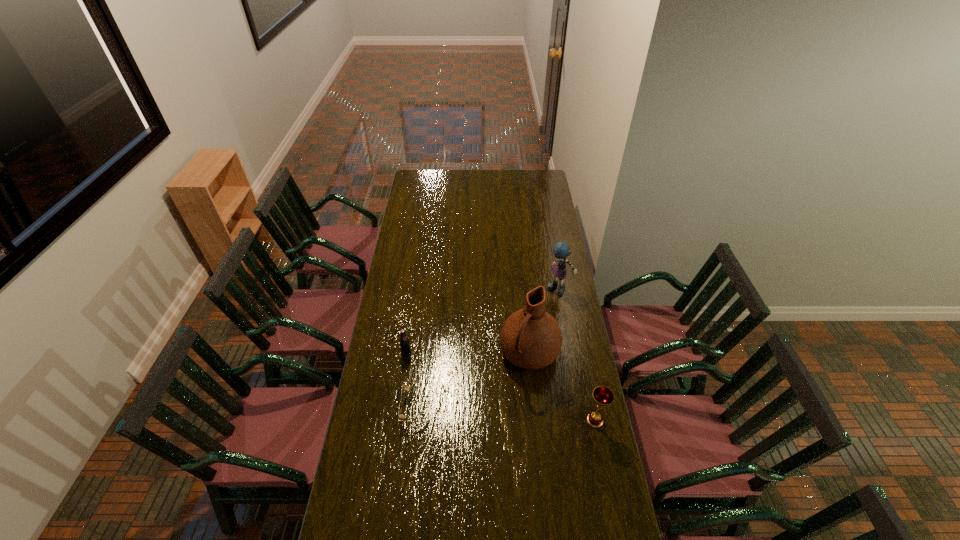
What are the coordinates of `vacant spot on the desktop that is between the sunglasses and the chalice and is positioned on the side of the tallest object with the handle` in the screenshot? It's located at pos(492,413).

The image size is (960, 540). Find the location of `free space on the desktop that is between the sunglasses and the chalice and is positioned on the front-facing side of the second tallest object`. free space on the desktop that is between the sunglasses and the chalice and is positioned on the front-facing side of the second tallest object is located at coordinates (488, 413).

Where is `free space on the desktop that is between the sunglasses and the chalice and is positioned on the front label of the fourth tallest object`? free space on the desktop that is between the sunglasses and the chalice and is positioned on the front label of the fourth tallest object is located at coordinates (482, 413).